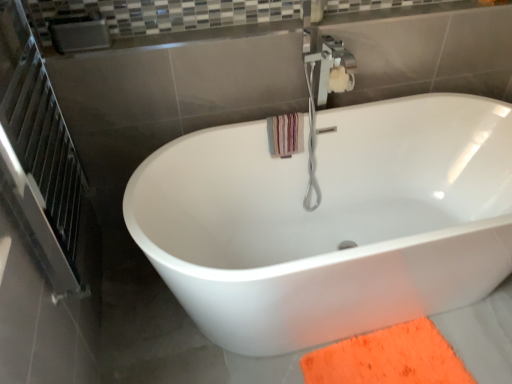
You are a GUI agent. You are given a task and a screenshot of the screen. Output one action in this format:
    pyautogui.click(x=<x>, y=<y>)
    Task: Click on the vacant space underneath orange fuzzy doormat at lower right (from a real-world perspective)
    
    Given the screenshot: What is the action you would take?
    pyautogui.click(x=391, y=365)